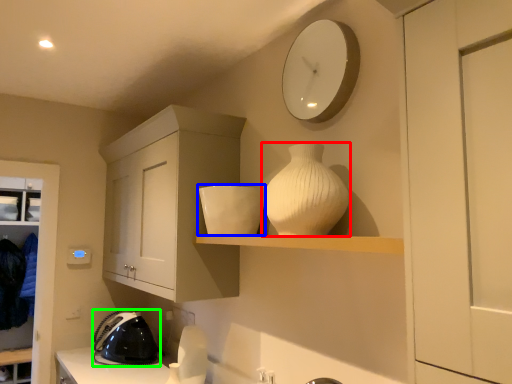
Question: Which object is positioned closest to vase (highlighted by a red box)? Select from appliance (highlighted by a blue box) and appliance (highlighted by a green box).

Choices:
 (A) appliance
 (B) appliance

Answer: (A)